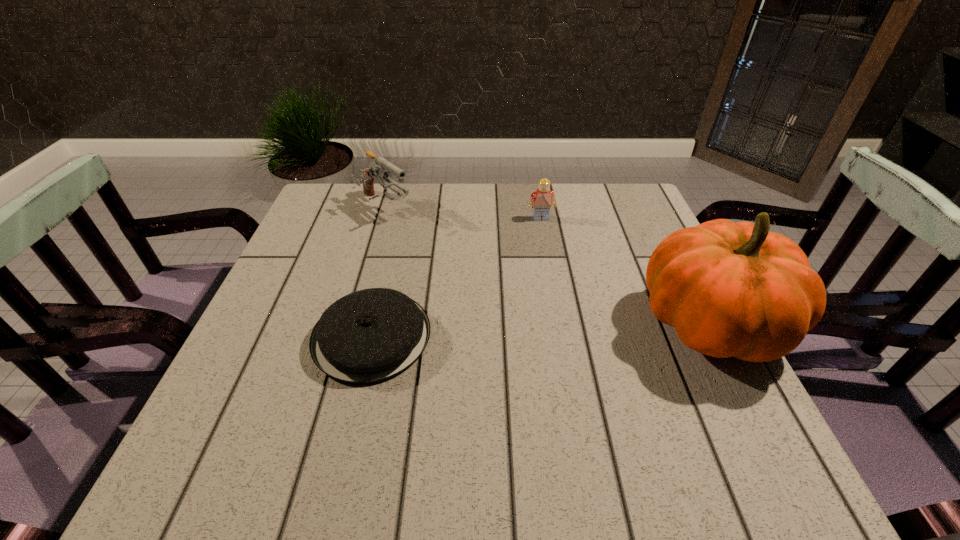
The image size is (960, 540). Find the location of `free region located on the front-facing side of the second object from right to left`. free region located on the front-facing side of the second object from right to left is located at coordinates (547, 237).

Where is `vacant region located 0.130m at the barrel end of the third shortest object`? vacant region located 0.130m at the barrel end of the third shortest object is located at coordinates (431, 246).

Locate an element on the screen. vacant space situated at the barrel end of the third shortest object is located at coordinates (492, 292).

Identify the location of vacant space located 0.060m at the barrel end of the third shortest object. (415, 234).

Identify the location of Lego that is at the far edge. (543, 198).

Where is `gun located in the far edge section of the desktop`? The image size is (960, 540). gun located in the far edge section of the desktop is located at coordinates (377, 169).

Find the location of a particular element. pancake at the near edge is located at coordinates pos(368,336).

The width and height of the screenshot is (960, 540). Find the location of `pumpkin present at the near edge`. pumpkin present at the near edge is located at coordinates (729, 289).

You are a GUI agent. You are given a task and a screenshot of the screen. Output one action in this format:
    pyautogui.click(x=<x>, y=<y>)
    Task: Click on the pancake positioned at the left edge
    This screenshot has height=540, width=960.
    Given the screenshot: What is the action you would take?
    pyautogui.click(x=368, y=336)

Locate an element on the screen. The width and height of the screenshot is (960, 540). gun that is at the left edge is located at coordinates (377, 169).